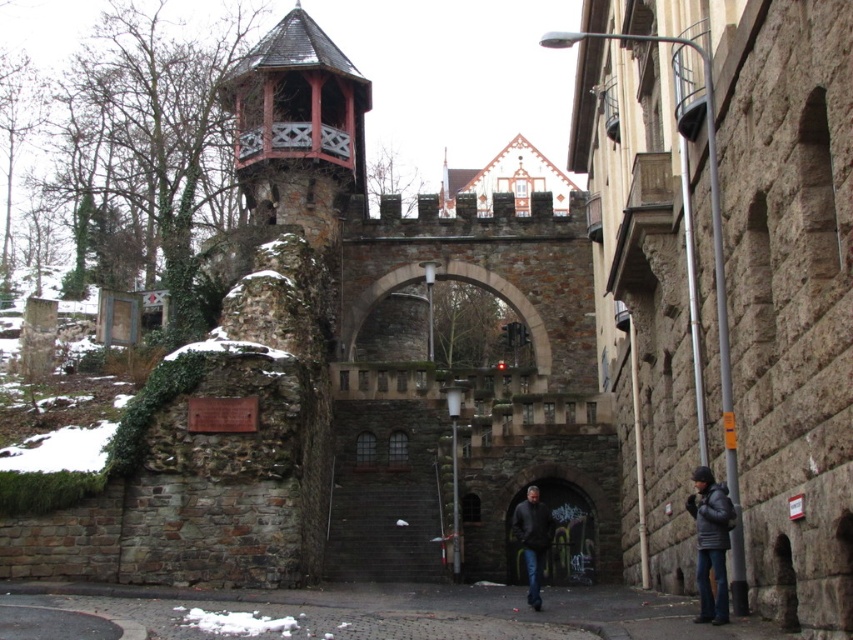
Can you confirm if dark gray stone archway at center is taller than dark gray puffy jacket at lower right?

Yes, dark gray stone archway at center is taller than dark gray puffy jacket at lower right.

Can you confirm if dark gray stone archway at center is wider than dark gray puffy jacket at lower right?

Yes.

At what (x,y) coordinates should I click in order to perform the action: click on dark gray stone archway at center. Please return your answer as a coordinate pair (x, y). Image resolution: width=853 pixels, height=640 pixels. Looking at the image, I should click on (x=567, y=532).

Measure the distance between point (554, 531) and camera.

Point (554, 531) is 229.79 feet away from camera.

Can you confirm if dark gray stone archway at center is smaller than dark gray jacket at center?

No, dark gray stone archway at center is not smaller than dark gray jacket at center.

This screenshot has height=640, width=853. Find the location of `dark gray stone archway at center`. dark gray stone archway at center is located at coordinates (567, 532).

Locate an element on the screen. This screenshot has width=853, height=640. dark gray stone archway at center is located at coordinates (567, 532).

Can you confirm if dark gray puffy jacket at lower right is wider than dark gray jacket at center?

In fact, dark gray puffy jacket at lower right might be narrower than dark gray jacket at center.

Can you confirm if dark gray puffy jacket at lower right is shorter than dark gray jacket at center?

Yes, dark gray puffy jacket at lower right is shorter than dark gray jacket at center.

Measure the distance between dark gray puffy jacket at lower right and camera.

118.98 feet

The width and height of the screenshot is (853, 640). Find the location of `dark gray puffy jacket at lower right`. dark gray puffy jacket at lower right is located at coordinates (711, 541).